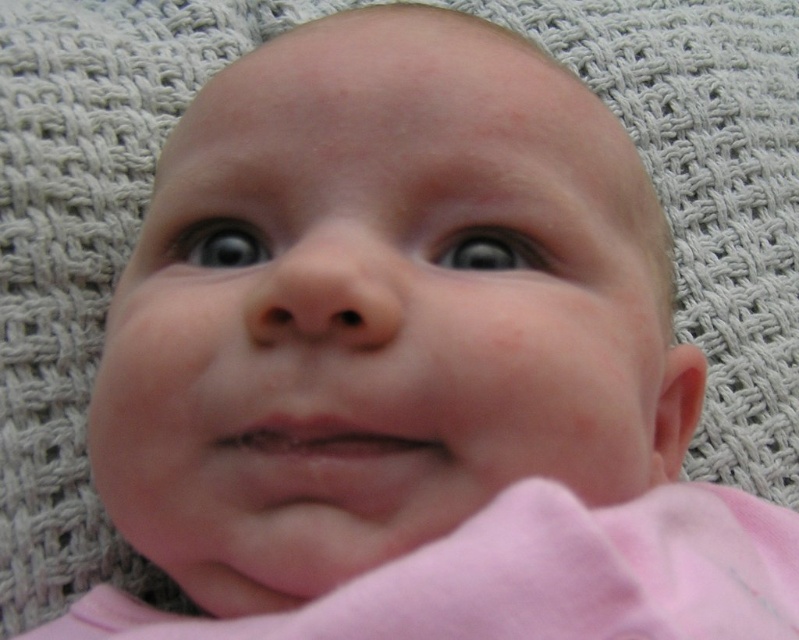
Question: Observing the image, what is the correct spatial positioning of blue smooth eye at center in reference to blue glossy eye at upper left?

Choices:
 (A) above
 (B) below

Answer: (B)

Question: Can you confirm if blue smooth eye at center is positioned above blue glossy eye at upper left?

Choices:
 (A) yes
 (B) no

Answer: (B)

Question: Can you confirm if blue smooth eye at center is bigger than blue glossy eye at upper left?

Choices:
 (A) yes
 (B) no

Answer: (B)

Question: Which point is closer to the camera taking this photo?

Choices:
 (A) (519, 244)
 (B) (213, 221)

Answer: (A)